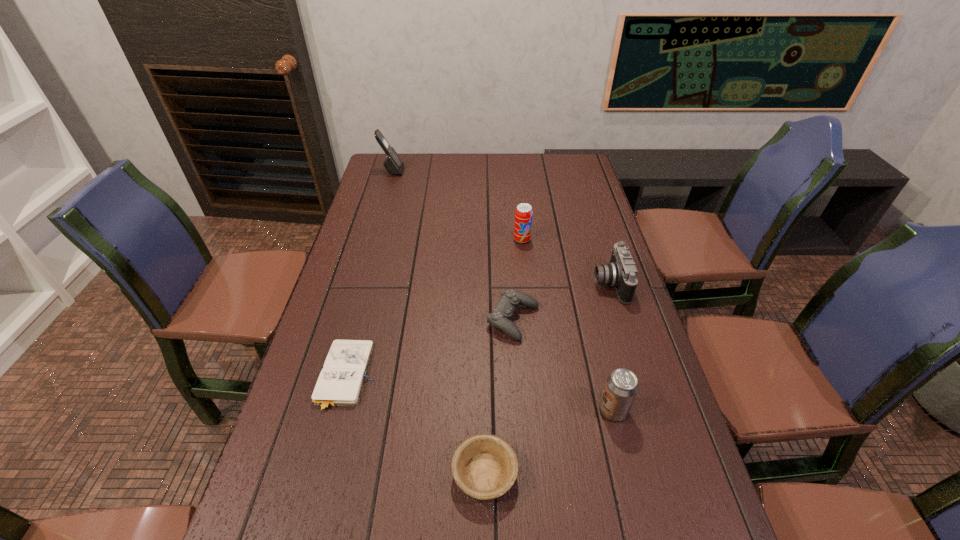
Find the location of a particular element. cellular telephone is located at coordinates (394, 165).

Identify the location of the farthest object. (394, 165).

At what (x,y) coordinates should I click in order to perform the action: click on soda can. Please return your answer as a coordinate pair (x, y). Looking at the image, I should click on (523, 214).

Locate an element on the screen. the sixth object from left to right is located at coordinates (621, 387).

Where is `the rightmost object`? the rightmost object is located at coordinates (621, 272).

The width and height of the screenshot is (960, 540). Identify the location of the third shortest object. (500, 317).

The width and height of the screenshot is (960, 540). I want to click on bowl, so click(x=484, y=466).

Find the location of `the second shortest object`. the second shortest object is located at coordinates (x=484, y=466).

The width and height of the screenshot is (960, 540). Find the location of `notebook`. notebook is located at coordinates (340, 382).

At what (x,y) coordinates should I click in order to perform the action: click on free space located 0.360m on the front-facing side of the tallest object. Please return your answer as a coordinate pair (x, y). This screenshot has width=960, height=540. Looking at the image, I should click on (492, 171).